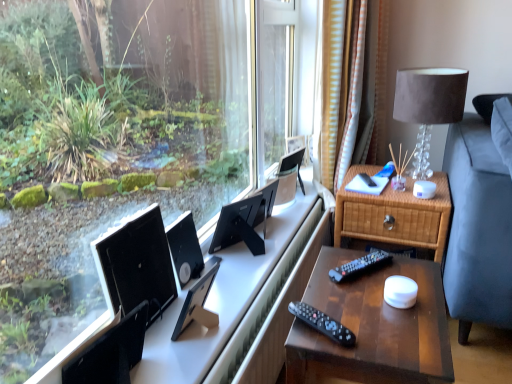
Where is `unoccupied region to the right of black matte computer monitor at center, positioned as the 4th computer monitor in front-to-back order`? unoccupied region to the right of black matte computer monitor at center, positioned as the 4th computer monitor in front-to-back order is located at coordinates (271, 249).